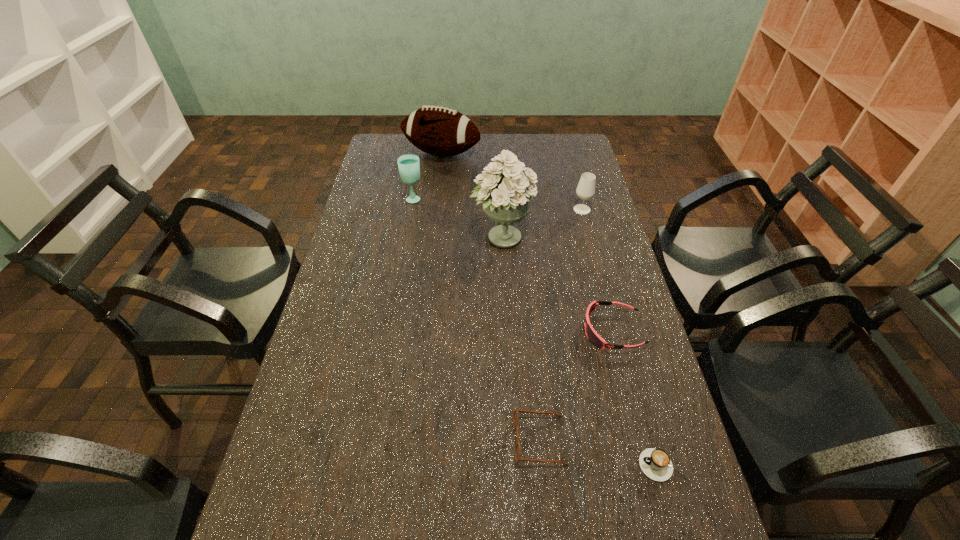
Find the location of a particular element. object that is at the far left corner is located at coordinates (440, 131).

At what (x,y) coordinates should I click in order to perform the action: click on vacant space at the far edge. Please return your answer as a coordinate pair (x, y). Looking at the image, I should click on (484, 139).

This screenshot has width=960, height=540. In order to click on vacant space at the left edge of the desktop in this screenshot , I will do `click(329, 290)`.

Locate an element on the screen. This screenshot has width=960, height=540. free region at the right edge of the desktop is located at coordinates (666, 503).

The width and height of the screenshot is (960, 540). I want to click on vacant region at the far left corner, so click(372, 157).

Locate an element on the screen. This screenshot has width=960, height=540. vacant region between the tallest object and the spectacles is located at coordinates (520, 339).

I want to click on free space between the football (American) and the cappuccino, so click(x=552, y=310).

In order to click on free point between the spectacles and the cappuccino in this screenshot , I will do `click(601, 453)`.

You are a GUI agent. You are given a task and a screenshot of the screen. Output one action in this format:
    pyautogui.click(x=<x>, y=<y>)
    Task: Click on the free space that is in between the second tallest object and the third tallest object
    Image resolution: width=960 pixels, height=540 pixels.
    Given the screenshot: What is the action you would take?
    pyautogui.click(x=427, y=176)

You are a GUI agent. You are given a task and a screenshot of the screen. Output one action in this format:
    pyautogui.click(x=<x>, y=<y>)
    Task: Click on the vacant area that lies between the spectacles and the third shortest object
    This screenshot has height=540, width=960.
    Given the screenshot: What is the action you would take?
    pyautogui.click(x=576, y=386)